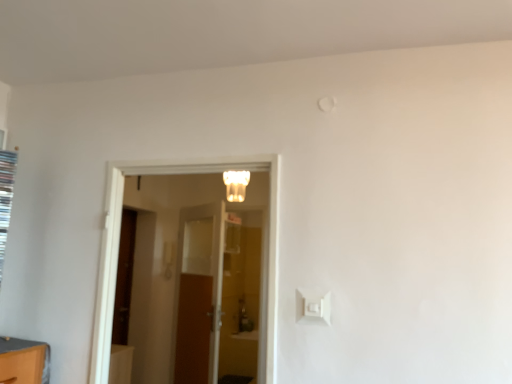
Question: Which direction should I rotate to look at wooden door at center, acting as the first door starting from the back?

Choices:
 (A) left
 (B) right

Answer: (A)

Question: From the image's perspective, would you say white frosted glass light fixture at center is shown under white glossy door at center, placed as the 1th door when sorted from front to back?

Choices:
 (A) yes
 (B) no

Answer: (B)

Question: Is white frosted glass light fixture at center taller than white glossy door at center, arranged as the 2th door when viewed from the back?

Choices:
 (A) yes
 (B) no

Answer: (B)

Question: Would you say white frosted glass light fixture at center is outside white glossy door at center, arranged as the 2th door when viewed from the back?

Choices:
 (A) no
 (B) yes

Answer: (B)

Question: From a real-world perspective, is white frosted glass light fixture at center over white glossy door at center, arranged as the 2th door when viewed from the back?

Choices:
 (A) yes
 (B) no

Answer: (A)

Question: Is white frosted glass light fixture at center shorter than white glossy door at center, placed as the 1th door when sorted from front to back?

Choices:
 (A) no
 (B) yes

Answer: (B)

Question: Does white frosted glass light fixture at center lie behind white glossy door at center, arranged as the 2th door when viewed from the back?

Choices:
 (A) yes
 (B) no

Answer: (A)

Question: Is white plastic light switch at lower right positioned with its back to white glossy door at center, arranged as the 2th door when viewed from the back?

Choices:
 (A) no
 (B) yes

Answer: (A)

Question: Are white plastic light switch at lower right and white glossy door at center, placed as the 1th door when sorted from front to back, making contact?

Choices:
 (A) no
 (B) yes

Answer: (A)

Question: Can you confirm if white plastic light switch at lower right is taller than white glossy door at center, arranged as the 2th door when viewed from the back?

Choices:
 (A) yes
 (B) no

Answer: (B)

Question: From a real-world perspective, is white plastic light switch at lower right on top of white glossy door at center, arranged as the 2th door when viewed from the back?

Choices:
 (A) yes
 (B) no

Answer: (B)

Question: Can you confirm if white plastic light switch at lower right is wider than white glossy door at center, arranged as the 2th door when viewed from the back?

Choices:
 (A) no
 (B) yes

Answer: (A)

Question: Is white plastic light switch at lower right further to camera compared to white glossy door at center, placed as the 1th door when sorted from front to back?

Choices:
 (A) no
 (B) yes

Answer: (A)

Question: Would you say white plastic light switch at lower right contains white frosted glass light fixture at center?

Choices:
 (A) no
 (B) yes

Answer: (A)